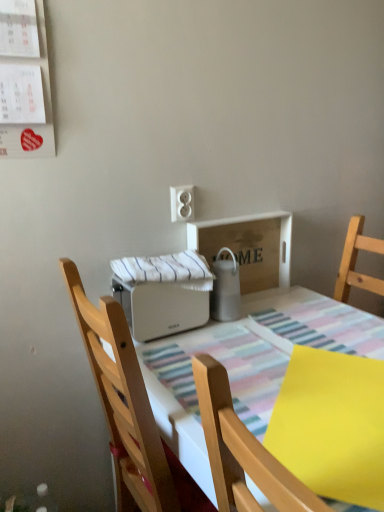
Where is `free space in front of satin silver thermos at center, arranged as the first appliance when viewed from the right`? This screenshot has height=512, width=384. free space in front of satin silver thermos at center, arranged as the first appliance when viewed from the right is located at coordinates (241, 342).